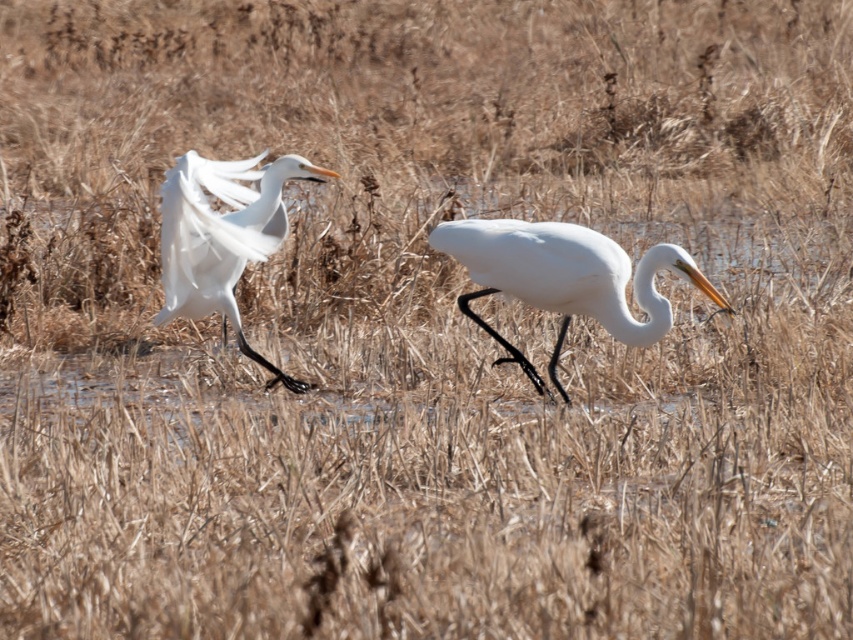
Question: Does white smooth heron at center appear on the left side of white feathered bird at center?

Choices:
 (A) no
 (B) yes

Answer: (A)

Question: Can you confirm if white smooth heron at center is positioned to the left of white feathered bird at center?

Choices:
 (A) yes
 (B) no

Answer: (B)

Question: Does white smooth heron at center appear on the right side of white feathered bird at center?

Choices:
 (A) no
 (B) yes

Answer: (B)